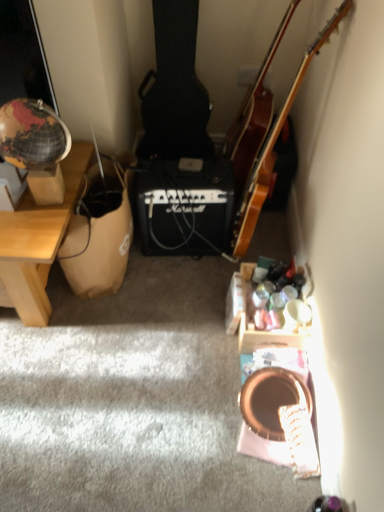
Locate an element on the screen. vacant area that lies to the right of brown paper bag at left is located at coordinates (184, 283).